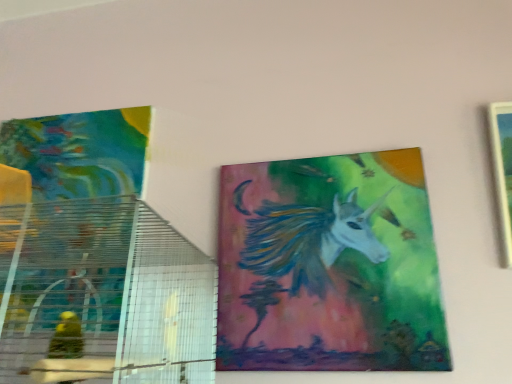
What do you see at coordinates (503, 170) in the screenshot? The width and height of the screenshot is (512, 384). I see `wooden frame at right, positioned as the second picture frame in left-to-right order` at bounding box center [503, 170].

The width and height of the screenshot is (512, 384). I want to click on wooden frame at right, which ranks as the first picture frame in right-to-left order, so click(x=503, y=170).

Measure the distance between point (506, 219) and camera.

Point (506, 219) is 30.16 inches away from camera.

Describe the element at coordinates (329, 266) in the screenshot. I see `painted unicorn at center, positioned as the second picture frame in right-to-left order` at that location.

The width and height of the screenshot is (512, 384). Find the location of `painted unicorn at center, positioned as the second picture frame in right-to-left order`. painted unicorn at center, positioned as the second picture frame in right-to-left order is located at coordinates (329, 266).

How much space does painted unicorn at center, positioned as the second picture frame in right-to-left order, occupy vertically?

painted unicorn at center, positioned as the second picture frame in right-to-left order, is 15.70 inches tall.

Identify the location of wooden frame at right, positioned as the second picture frame in left-to-right order. This screenshot has width=512, height=384. (503, 170).

Which is more to the left, wooden frame at right, which ranks as the first picture frame in right-to-left order, or painted unicorn at center, the first picture frame when ordered from left to right?

Positioned to the left is painted unicorn at center, the first picture frame when ordered from left to right.

Is wooden frame at right, which ranks as the first picture frame in right-to-left order, behind painted unicorn at center, the first picture frame when ordered from left to right?

No, it is in front of painted unicorn at center, the first picture frame when ordered from left to right.

Considering the positions of points (496, 112) and (220, 245), is point (496, 112) closer to camera compared to point (220, 245)?

Yes, it is in front of point (220, 245).

From the image's perspective, does wooden frame at right, positioned as the second picture frame in left-to-right order, appear lower than painted unicorn at center, positioned as the second picture frame in right-to-left order?

Actually, wooden frame at right, positioned as the second picture frame in left-to-right order, appears above painted unicorn at center, positioned as the second picture frame in right-to-left order, in the image.

From a real-world perspective, is wooden frame at right, positioned as the second picture frame in left-to-right order, positioned above or below painted unicorn at center, positioned as the second picture frame in right-to-left order?

In terms of real-world spatial position, wooden frame at right, positioned as the second picture frame in left-to-right order, is above painted unicorn at center, positioned as the second picture frame in right-to-left order.

Considering the sizes of objects wooden frame at right, positioned as the second picture frame in left-to-right order, and painted unicorn at center, the first picture frame when ordered from left to right, in the image provided, who is thinner, wooden frame at right, positioned as the second picture frame in left-to-right order, or painted unicorn at center, the first picture frame when ordered from left to right,?

painted unicorn at center, the first picture frame when ordered from left to right.

Which of these two, wooden frame at right, positioned as the second picture frame in left-to-right order, or painted unicorn at center, positioned as the second picture frame in right-to-left order, stands taller?

Standing taller between the two is painted unicorn at center, positioned as the second picture frame in right-to-left order.

In the scene shown: Is wooden frame at right, positioned as the second picture frame in left-to-right order, bigger or smaller than painted unicorn at center, positioned as the second picture frame in right-to-left order?

wooden frame at right, positioned as the second picture frame in left-to-right order, is bigger than painted unicorn at center, positioned as the second picture frame in right-to-left order.

Would you say painted unicorn at center, positioned as the second picture frame in right-to-left order, is part of wooden frame at right, positioned as the second picture frame in left-to-right order,'s contents?

No, painted unicorn at center, positioned as the second picture frame in right-to-left order, is located outside of wooden frame at right, positioned as the second picture frame in left-to-right order.

Is there a large distance between wooden frame at right, positioned as the second picture frame in left-to-right order, and painted unicorn at center, the first picture frame when ordered from left to right?

No, wooden frame at right, positioned as the second picture frame in left-to-right order, is not far from painted unicorn at center, the first picture frame when ordered from left to right.

Is wooden frame at right, which ranks as the first picture frame in right-to-left order, looking in the opposite direction of painted unicorn at center, positioned as the second picture frame in right-to-left order?

wooden frame at right, which ranks as the first picture frame in right-to-left order, is not turned away from painted unicorn at center, positioned as the second picture frame in right-to-left order.

What's the angular difference between wooden frame at right, which ranks as the first picture frame in right-to-left order, and painted unicorn at center, positioned as the second picture frame in right-to-left order,'s facing directions?

The angular difference between wooden frame at right, which ranks as the first picture frame in right-to-left order, and painted unicorn at center, positioned as the second picture frame in right-to-left order, is 0.00166 degrees.

Measure the distance from wooden frame at right, which ranks as the first picture frame in right-to-left order, to painted unicorn at center, the first picture frame when ordered from left to right.

wooden frame at right, which ranks as the first picture frame in right-to-left order, is 30.62 centimeters away from painted unicorn at center, the first picture frame when ordered from left to right.

Identify the location of picture frame in front of the painted unicorn at center, the first picture frame when ordered from left to right. The height and width of the screenshot is (384, 512). (503, 170).

Based on their positions, is painted unicorn at center, positioned as the second picture frame in right-to-left order, located to the left or right of wooden frame at right, positioned as the second picture frame in left-to-right order?

Based on their positions, painted unicorn at center, positioned as the second picture frame in right-to-left order, is located to the left of wooden frame at right, positioned as the second picture frame in left-to-right order.

Looking at this image, which is behind, painted unicorn at center, positioned as the second picture frame in right-to-left order, or wooden frame at right, which ranks as the first picture frame in right-to-left order?

painted unicorn at center, positioned as the second picture frame in right-to-left order, is behind.

Between point (395, 261) and point (496, 137), which one is positioned behind?

The point (496, 137) is farther.

From the image's perspective, is painted unicorn at center, positioned as the second picture frame in right-to-left order, positioned above or below wooden frame at right, positioned as the second picture frame in left-to-right order?

painted unicorn at center, positioned as the second picture frame in right-to-left order, is situated lower than wooden frame at right, positioned as the second picture frame in left-to-right order, in the image.

From a real-world perspective, between painted unicorn at center, positioned as the second picture frame in right-to-left order, and wooden frame at right, which ranks as the first picture frame in right-to-left order, who is vertically lower?

In real-world perspective, painted unicorn at center, positioned as the second picture frame in right-to-left order, is lower.

Considering the relative sizes of painted unicorn at center, the first picture frame when ordered from left to right, and wooden frame at right, which ranks as the first picture frame in right-to-left order, in the image provided, is painted unicorn at center, the first picture frame when ordered from left to right, wider than wooden frame at right, which ranks as the first picture frame in right-to-left order,?

No, painted unicorn at center, the first picture frame when ordered from left to right, is not wider than wooden frame at right, which ranks as the first picture frame in right-to-left order.

Considering the relative sizes of painted unicorn at center, positioned as the second picture frame in right-to-left order, and wooden frame at right, which ranks as the first picture frame in right-to-left order, in the image provided, is painted unicorn at center, positioned as the second picture frame in right-to-left order, shorter than wooden frame at right, which ranks as the first picture frame in right-to-left order,?

Incorrect, the height of painted unicorn at center, positioned as the second picture frame in right-to-left order, does not fall short of that of wooden frame at right, which ranks as the first picture frame in right-to-left order.

Is painted unicorn at center, positioned as the second picture frame in right-to-left order, bigger than wooden frame at right, which ranks as the first picture frame in right-to-left order?

No.

Would you say painted unicorn at center, positioned as the second picture frame in right-to-left order, is inside or outside wooden frame at right, which ranks as the first picture frame in right-to-left order?

painted unicorn at center, positioned as the second picture frame in right-to-left order, is located beyond the bounds of wooden frame at right, which ranks as the first picture frame in right-to-left order.

Is painted unicorn at center, the first picture frame when ordered from left to right, placed right next to wooden frame at right, which ranks as the first picture frame in right-to-left order?

painted unicorn at center, the first picture frame when ordered from left to right, is not next to wooden frame at right, which ranks as the first picture frame in right-to-left order, and they're not touching.

Is painted unicorn at center, the first picture frame when ordered from left to right, turned away from wooden frame at right, positioned as the second picture frame in left-to-right order?

No, wooden frame at right, positioned as the second picture frame in left-to-right order, is not at the back of painted unicorn at center, the first picture frame when ordered from left to right.

You are a GUI agent. You are given a task and a screenshot of the screen. Output one action in this format:
    pyautogui.click(x=<x>, y=<y>)
    Task: Click on the picture frame on the right of painted unicorn at center, the first picture frame when ordered from left to right
    
    Given the screenshot: What is the action you would take?
    pyautogui.click(x=503, y=170)

Where is `picture frame above the painted unicorn at center, positioned as the second picture frame in right-to-left order (from the image's perspective)`? The height and width of the screenshot is (384, 512). picture frame above the painted unicorn at center, positioned as the second picture frame in right-to-left order (from the image's perspective) is located at coordinates (503, 170).

This screenshot has height=384, width=512. Identify the location of picture frame directly beneath the wooden frame at right, which ranks as the first picture frame in right-to-left order (from a real-world perspective). (329, 266).